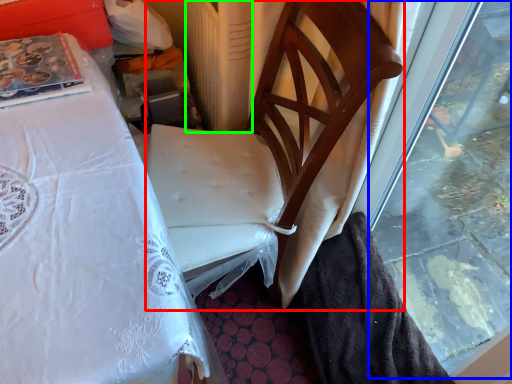
Question: Based on their relative distances, which object is nearer to chair (highlighted by a red box)? Choose from window (highlighted by a blue box) and radiator (highlighted by a green box).

Choices:
 (A) window
 (B) radiator

Answer: (B)